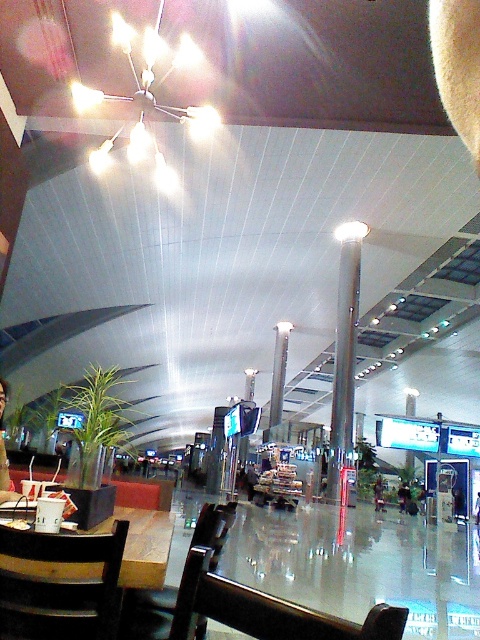
You are a traveler who needs to sit down. You see a wooden chair at lower center and a black plastic chair at center. Which chair is closer to you?

The wooden chair at lower center is closer to you because it is positioned over the black plastic chair at center, indicating it is in front and thus nearer.

You are standing at the entrance of the airport terminal and want to sit down. There is a wooden chair at lower left. Based on its position, can you estimate where it is located in the image?

The wooden chair at lower left is located at the coordinates point (60, 586) in the image.

From the picture: You are a traveler who just arrived at the airport and need to sit down. You see a wooden table at center and a black plastic chair at center. Which one should you approach first to sit?

The wooden table at center is positioned over black plastic chair at center, so you should approach the black plastic chair at center first before reaching the wooden table at center to sit.